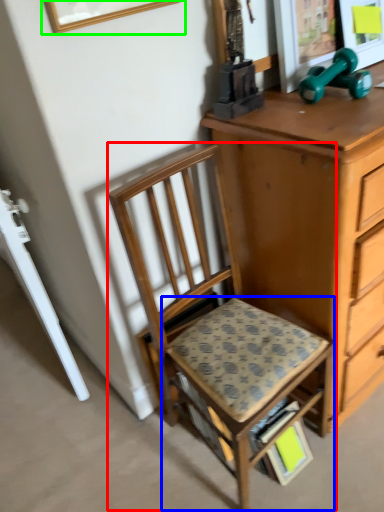
Question: Which is nearer to the chair (highlighted by a red box)? step stool (highlighted by a blue box) or picture frame (highlighted by a green box).

Choices:
 (A) step stool
 (B) picture frame

Answer: (A)